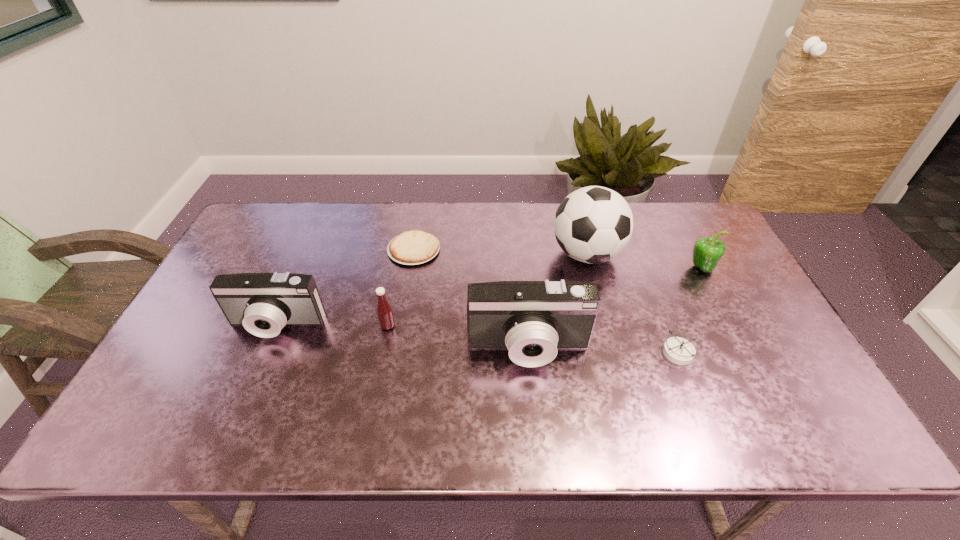
The height and width of the screenshot is (540, 960). I want to click on the left camcorder, so click(263, 303).

Locate an element on the screen. The width and height of the screenshot is (960, 540). the shorter camcorder is located at coordinates (263, 303).

Locate an element on the screen. This screenshot has width=960, height=540. the taller camcorder is located at coordinates (532, 319).

The height and width of the screenshot is (540, 960). I want to click on the right camcorder, so click(532, 319).

I want to click on the shortest object, so click(x=414, y=247).

Find the location of a particular element. This screenshot has height=540, width=960. soccer ball is located at coordinates (594, 224).

Where is `the sixth tallest object`? the sixth tallest object is located at coordinates (678, 350).

Where is `the sixth object from left to right`? The image size is (960, 540). the sixth object from left to right is located at coordinates (678, 350).

Find the location of `the rightmost object`. the rightmost object is located at coordinates (707, 252).

The image size is (960, 540). Find the location of `Tabasco sauce`. Tabasco sauce is located at coordinates (384, 310).